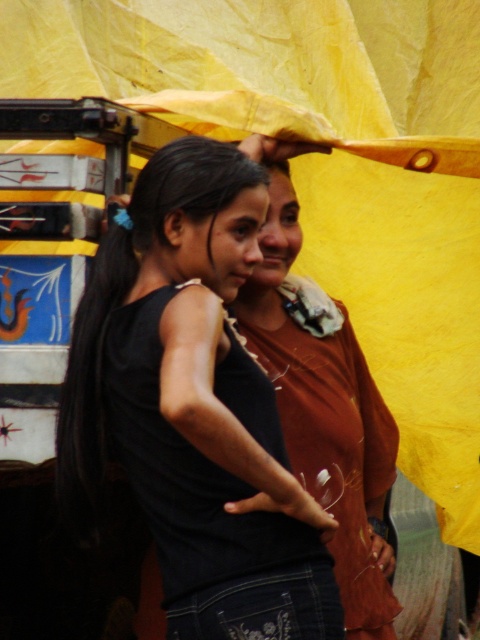
You are at a fair and see two people under a yellow tarp. The first person is wearing a black matte tank top at center, and the second person is wearing a matte brown shirt at center. Which clothing item is higher up?

The black matte tank top at center is located above the matte brown shirt at center.